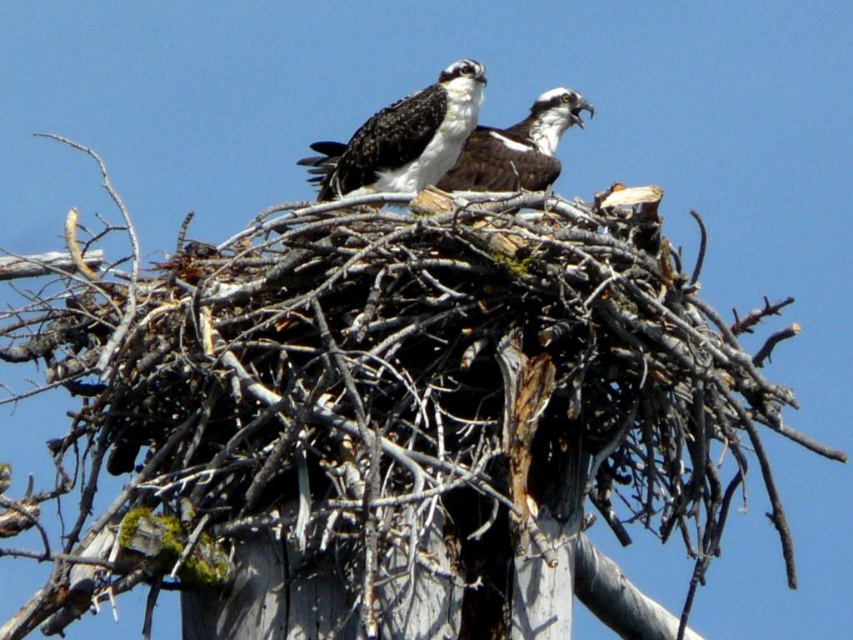
You are a birdwatcher trying to locate the black and white feathers at center in the image. According to the coordinates provided, where exactly would you find them?

The black and white feathers at center are located at coordinates point (409, 138).

You are a birdwatcher observing the nest from below. You notice the black and white feathers at center and the white glossy bird at center. Which object is closer to the ground?

The black and white feathers at center are positioned under the white glossy bird at center, so the black and white feathers at center are closer to the ground.

You are a birdwatcher observing an osprey nest from a distance. You notice a specific point marked at coordinates point (409, 138). Based on the scene, what is this point likely located on?

The point (409, 138) is on black and white feathers at center, so it is likely located on the feathers of the ospreys in the nest.